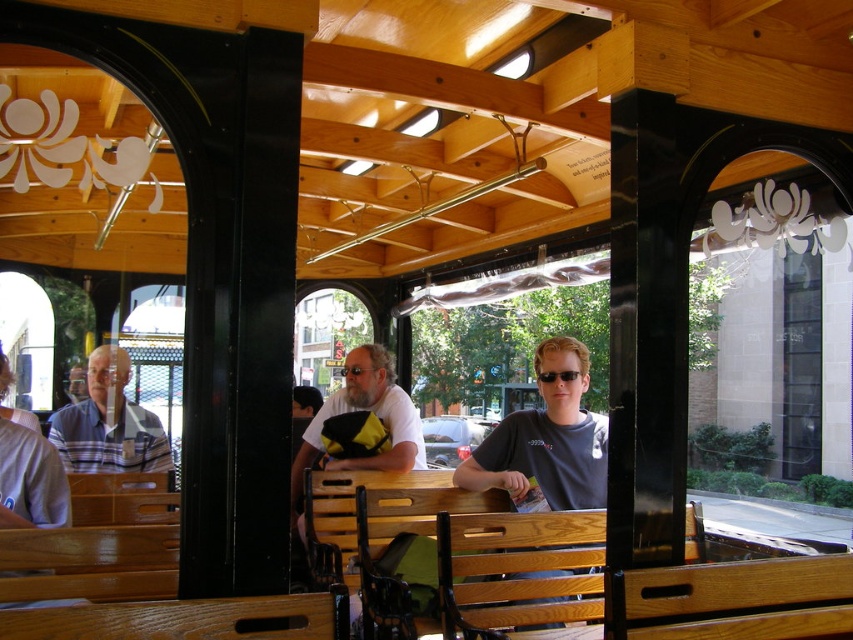
You are inside the vintage tram and looking through the arched windows. There are two points marked on the window glass. The first point is at coordinates point (x=90, y=364) and the second point is at point (x=323, y=461). Which point is closer to your eyes?

Point (x=90, y=364) is further to the camera than point (x=323, y=461), so the point closer to your eyes is point (x=323, y=461).